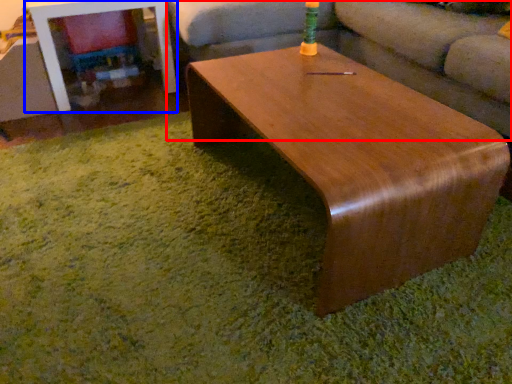
Question: Which object appears closest to the camera in this image, studio couch (highlighted by a red box) or table (highlighted by a blue box)?

Choices:
 (A) studio couch
 (B) table

Answer: (A)